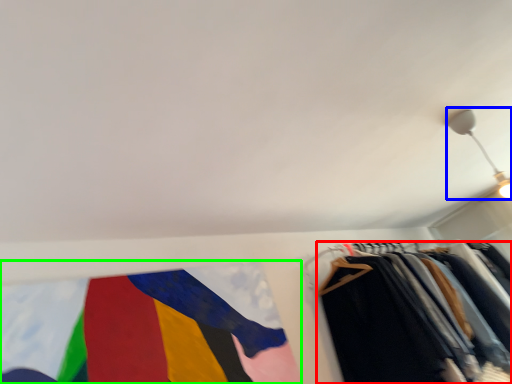
Question: Estimate the real-world distances between objects in this image. Which object is closer to trousers (highlighted by a red box), light fixture (highlighted by a blue box) or flag (highlighted by a green box)?

Choices:
 (A) light fixture
 (B) flag

Answer: (B)